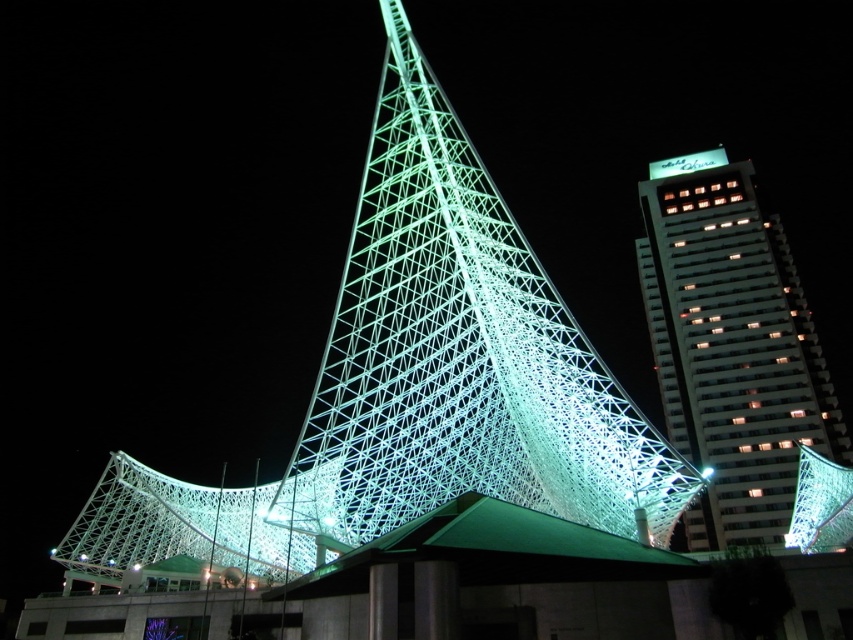
Is illuminated mesh structure at center positioned at the back of green illuminated sign at upper right?

No, it is not.

Is illuminated mesh structure at center smaller than green illuminated sign at upper right?

Actually, illuminated mesh structure at center might be larger than green illuminated sign at upper right.

Is point (532, 257) positioned in front of point (688, 154)?

Yes, it is in front of point (688, 154).

At what (x,y) coordinates should I click in order to perform the action: click on illuminated mesh structure at center. Please return your answer as a coordinate pair (x, y). Looking at the image, I should click on (457, 355).

Can you confirm if white glass skyscraper at upper right is shorter than green illuminated sign at upper right?

No.

Between point (811, 420) and point (656, 172), which one is positioned in front?

Positioned in front is point (811, 420).

Is point (701, 426) more distant than point (657, 161)?

No, (701, 426) is closer to viewer.

Identify the location of white glass skyscraper at upper right. (732, 353).

From the picture: Which of these two, illuminated mesh structure at center or white glass skyscraper at upper right, stands taller?

white glass skyscraper at upper right is taller.

This screenshot has height=640, width=853. What are the coordinates of `illuminated mesh structure at center` in the screenshot? It's located at (457, 355).

This screenshot has height=640, width=853. I want to click on illuminated mesh structure at center, so click(457, 355).